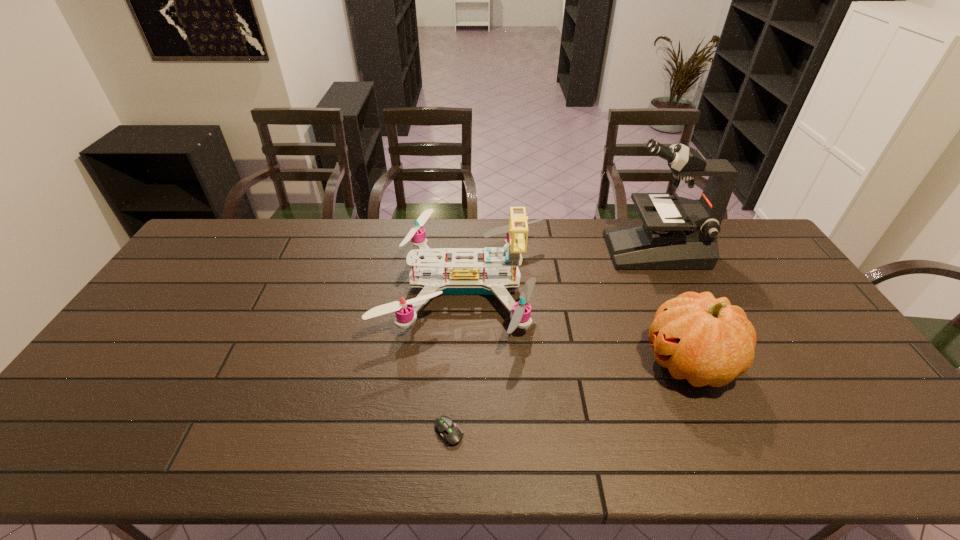
Image resolution: width=960 pixels, height=540 pixels. I want to click on vacant area in the image that satisfies the following two spatial constraints: 1. on the front-facing side of the drone; 2. on the front side of the nearest object, so click(460, 432).